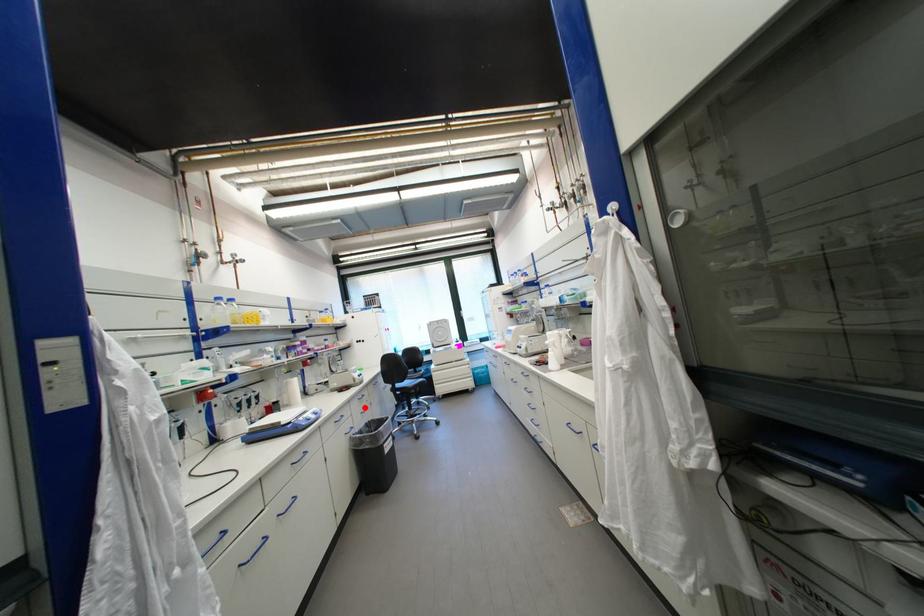
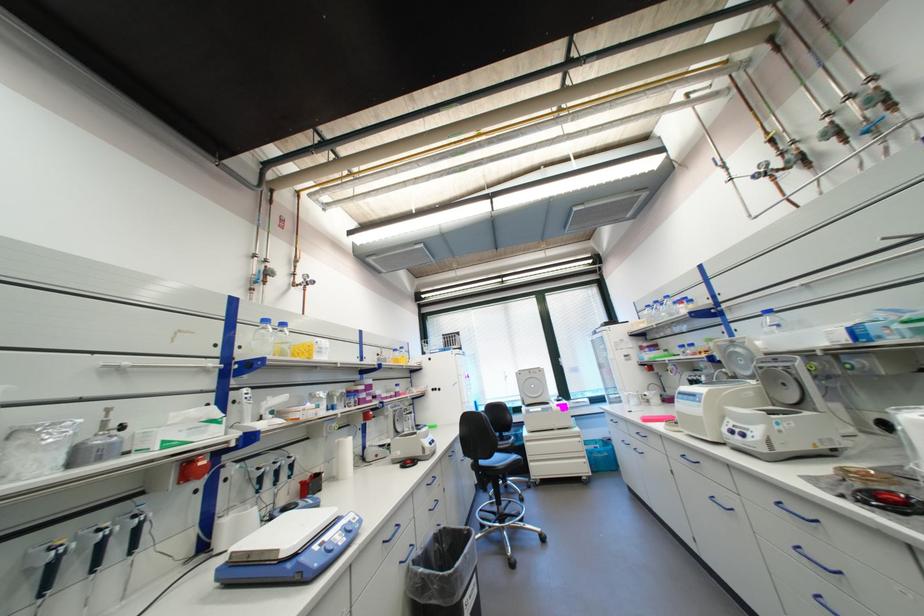
Question: I am providing you with two images of the same scene from different viewpoints. Given a red point in image1, look at the same physical point in image2. Is it:

Choices:
 (A) Closer to the viewpoint
 (B) Farther from the viewpoint

Answer: (B)